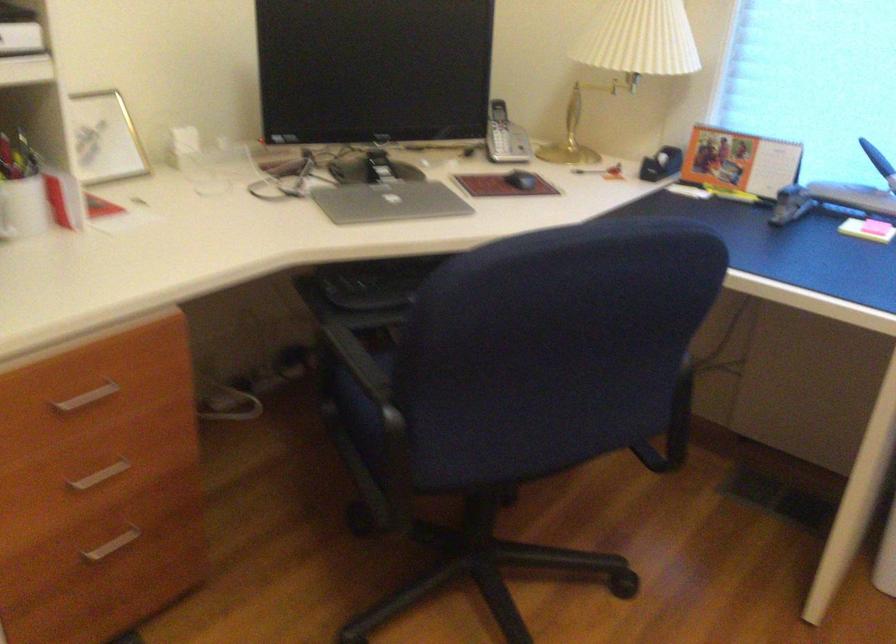
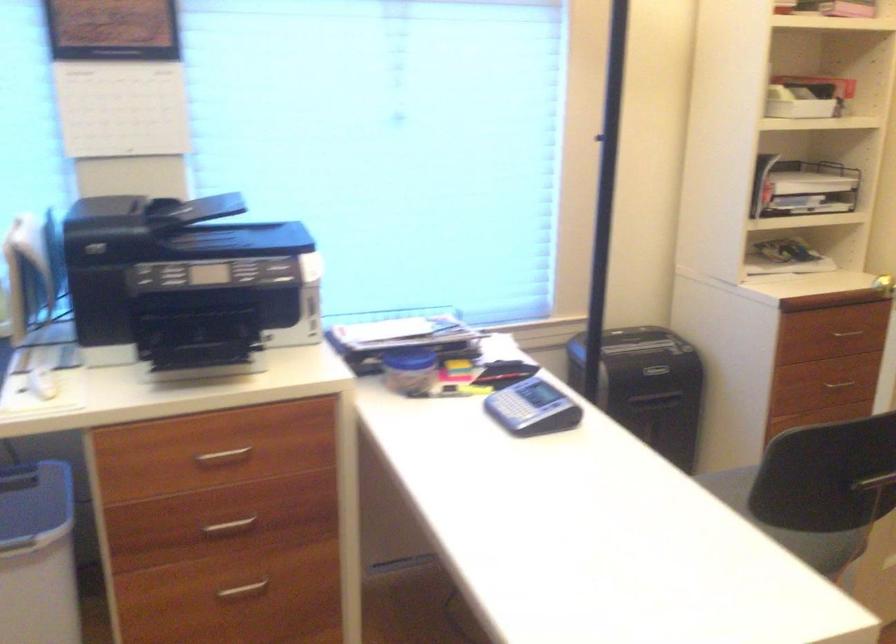
Question: The first image is from the beginning of the video and the second image is from the end. How did the camera likely rotate when shooting the video?

Choices:
 (A) Left
 (B) Right
 (C) Up
 (D) Down

Answer: (B)